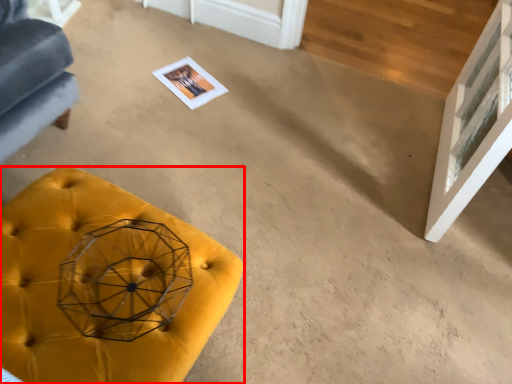
Question: From the image's perspective, what is the correct spatial positioning of furniture (annotated by the red box) in reference to glass door?

Choices:
 (A) above
 (B) below

Answer: (B)